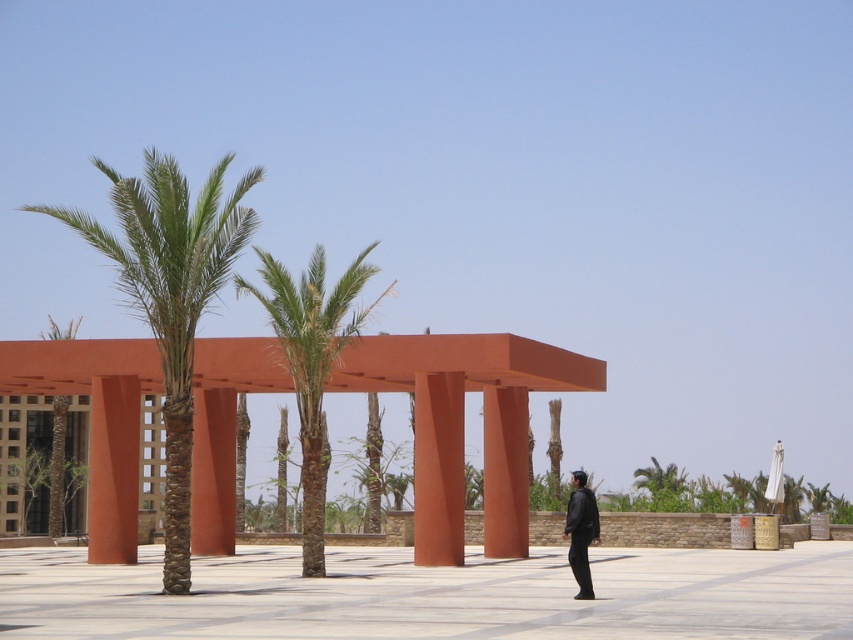
Can you confirm if matte orange pergola at center is positioned above black leather jacket at lower right?

Yes.

At what (x,y) coordinates should I click in order to perform the action: click on matte orange pergola at center. Please return your answer as a coordinate pair (x, y). The height and width of the screenshot is (640, 853). Looking at the image, I should click on (463, 422).

Who is more forward, (115, 464) or (573, 529)?

Positioned in front is point (573, 529).

In order to click on matte orange pergola at center in this screenshot , I will do `click(463, 422)`.

Is green leafy palm tree at center below green leafy palm tree at left?

Actually, green leafy palm tree at center is above green leafy palm tree at left.

Is point (297, 305) farther from viewer compared to point (56, 444)?

No, (297, 305) is in front of (56, 444).

Identify the location of green leafy palm tree at center. This screenshot has height=640, width=853. (312, 362).

Find the location of a particular element. This screenshot has width=853, height=640. green leafy palm tree at center is located at coordinates (312, 362).

Between matte orange pergola at center and green leafy palm tree at upper right, which one has more height?

Standing taller between the two is matte orange pergola at center.

Is the position of matte orange pergola at center more distant than that of green leafy palm tree at upper right?

No, it is in front of green leafy palm tree at upper right.

Which is in front, point (505, 433) or point (665, 508)?

Point (505, 433) is more forward.

In order to click on matte orange pergola at center in this screenshot , I will do `click(463, 422)`.